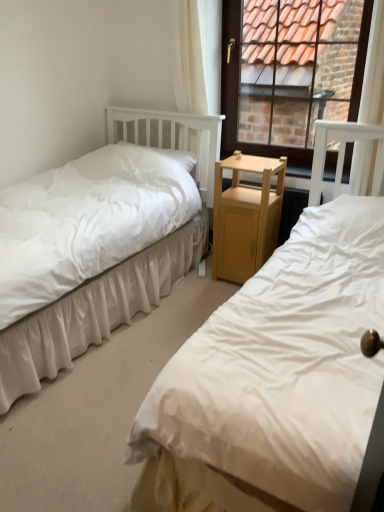
Question: Can you confirm if white sheer curtain at upper center is shorter than brown wooden window at upper center?

Choices:
 (A) yes
 (B) no

Answer: (B)

Question: Can you confirm if white sheer curtain at upper center is wider than brown wooden window at upper center?

Choices:
 (A) yes
 (B) no

Answer: (A)

Question: Does white sheer curtain at upper center turn towards brown wooden window at upper center?

Choices:
 (A) no
 (B) yes

Answer: (A)

Question: Is white sheer curtain at upper center turned away from brown wooden window at upper center?

Choices:
 (A) no
 (B) yes

Answer: (A)

Question: Is white sheer curtain at upper center closer to the viewer compared to brown wooden window at upper center?

Choices:
 (A) no
 (B) yes

Answer: (A)

Question: Is white sheer curtain at upper center positioned far away from brown wooden window at upper center?

Choices:
 (A) yes
 (B) no

Answer: (A)

Question: Is white fabric bed at left, which ranks as the first bed in right-to-left order, aimed at brown wooden window at upper center?

Choices:
 (A) no
 (B) yes

Answer: (A)

Question: Does white fabric bed at left, which ranks as the second bed in left-to-right order, have a lesser width compared to brown wooden window at upper center?

Choices:
 (A) no
 (B) yes

Answer: (A)

Question: Considering the relative sizes of white fabric bed at left, which ranks as the second bed in left-to-right order, and brown wooden window at upper center in the image provided, is white fabric bed at left, which ranks as the second bed in left-to-right order, wider than brown wooden window at upper center?

Choices:
 (A) yes
 (B) no

Answer: (A)

Question: Considering the relative sizes of white fabric bed at left, which ranks as the first bed in right-to-left order, and brown wooden window at upper center in the image provided, is white fabric bed at left, which ranks as the first bed in right-to-left order, smaller than brown wooden window at upper center?

Choices:
 (A) yes
 (B) no

Answer: (B)

Question: Can you confirm if white fabric bed at left, which ranks as the first bed in right-to-left order, is positioned to the left of brown wooden window at upper center?

Choices:
 (A) no
 (B) yes

Answer: (B)

Question: Is white fabric bed at left, which ranks as the second bed in left-to-right order, surrounding brown wooden window at upper center?

Choices:
 (A) yes
 (B) no

Answer: (B)

Question: From the image's perspective, is white fabric bed at left, the first bed positioned from the left, below light wood nightstand at center?

Choices:
 (A) yes
 (B) no

Answer: (A)